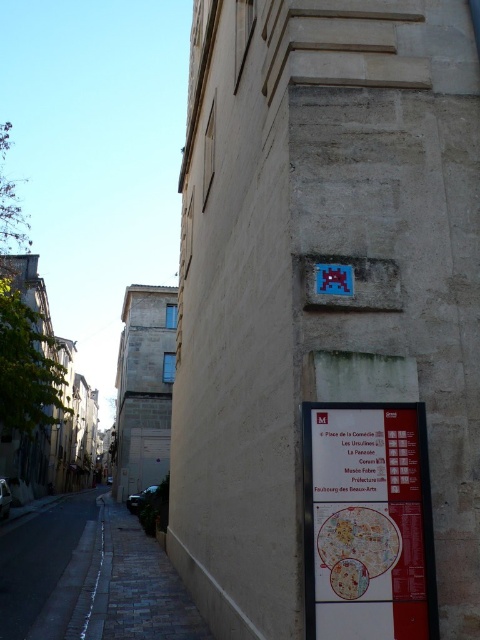
You are a tourist holding a white paper map at lower right and need to cross the dark asphalt road at lower left to reach the beige stone building on the right. Is the map in your hand positioned to the right or left of the road?

The white paper map at lower right is positioned on the right side of dark asphalt road at lower left, so the map in your hand is to the right of the road.

You are standing at the point labeled as point (x=50, y=552) and want to reach the beige stone building on the right side. Is the point labeled as point (x=339, y=470) located between you and the building?

Yes, the point labeled as point (x=339, y=470) is in front of point (x=50, y=552), which means it is between you and the beige stone building on the right side.